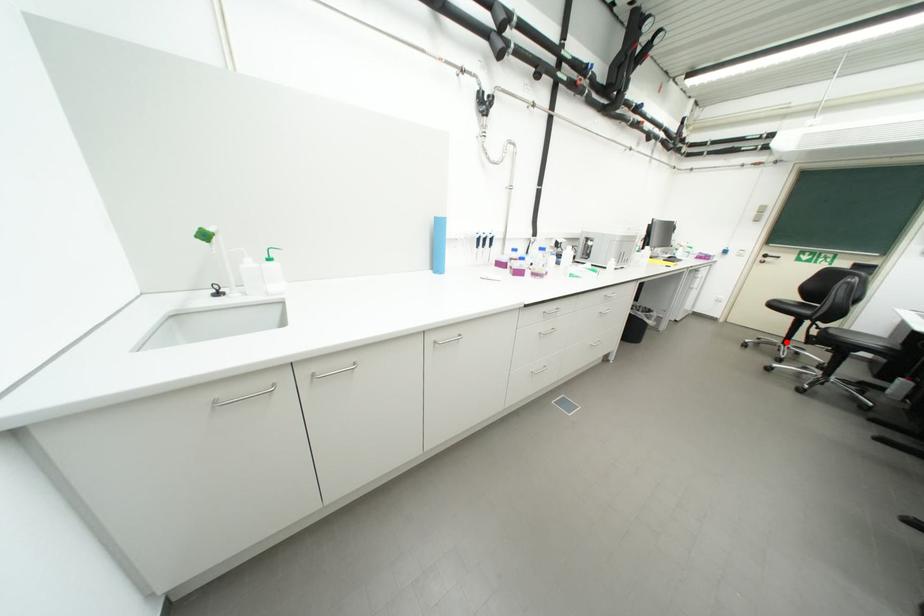
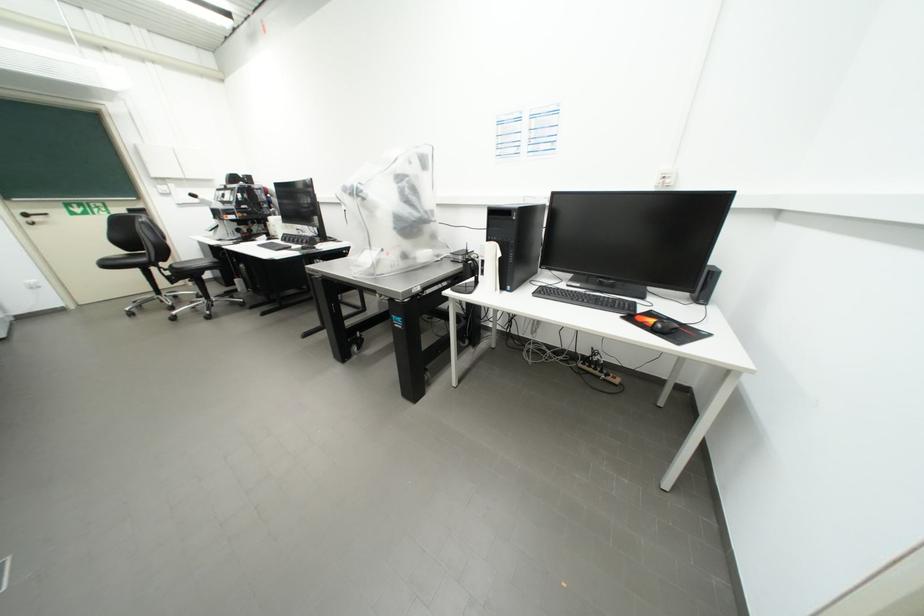
Question: I am providing you with two images of the same scene from different viewpoints. Given a red point in image1, look at the same physical point in image2. Is it:

Choices:
 (A) Closer to the viewpoint
 (B) Farther from the viewpoint

Answer: (A)